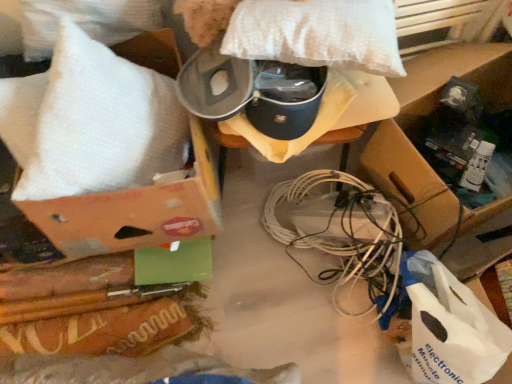
Question: Is brown cardboard box at lower right located within white bubble wrap at upper left, the 2th pillow when ordered from right to left?

Choices:
 (A) yes
 (B) no

Answer: (B)

Question: Is white bubble wrap at upper left, the 2th pillow when ordered from right to left, wider than brown cardboard box at lower right?

Choices:
 (A) yes
 (B) no

Answer: (B)

Question: Is white bubble wrap at upper left, marked as the first pillow in a left-to-right arrangement, shorter than brown cardboard box at lower right?

Choices:
 (A) yes
 (B) no

Answer: (A)

Question: Is white bubble wrap at upper left, the 2th pillow when ordered from right to left, with brown cardboard box at lower right?

Choices:
 (A) yes
 (B) no

Answer: (B)

Question: From the image's perspective, is white bubble wrap at upper left, the 2th pillow when ordered from right to left, below brown cardboard box at lower right?

Choices:
 (A) yes
 (B) no

Answer: (B)

Question: Looking at their shapes, would you say brown cardboard box at lower right is wider or thinner than white plastic wire at center?

Choices:
 (A) wide
 (B) thin

Answer: (A)

Question: From a real-world perspective, is brown cardboard box at lower right positioned above or below white plastic wire at center?

Choices:
 (A) below
 (B) above

Answer: (B)

Question: Considering the positions of point (509, 243) and point (329, 279), is point (509, 243) closer or farther from the camera than point (329, 279)?

Choices:
 (A) farther
 (B) closer

Answer: (A)

Question: From their relative heights in the image, would you say brown cardboard box at lower right is taller or shorter than white plastic wire at center?

Choices:
 (A) tall
 (B) short

Answer: (A)

Question: In the image, is white dotted pillow at upper center, which is the 2th pillow in left-to-right order, on the left side or the right side of brown cardboard box at lower right?

Choices:
 (A) left
 (B) right

Answer: (A)

Question: Considering the positions of white dotted pillow at upper center, which is the 2th pillow in left-to-right order, and brown cardboard box at lower right in the image, is white dotted pillow at upper center, which is the 2th pillow in left-to-right order, taller or shorter than brown cardboard box at lower right?

Choices:
 (A) tall
 (B) short

Answer: (B)

Question: Do you think white dotted pillow at upper center, the first pillow in the right-to-left sequence, is within brown cardboard box at lower right, or outside of it?

Choices:
 (A) outside
 (B) inside

Answer: (A)

Question: Is white dotted pillow at upper center, which is the 2th pillow in left-to-right order, wider or thinner than brown cardboard box at lower right?

Choices:
 (A) wide
 (B) thin

Answer: (B)

Question: In the image, is white plastic bag at lower right positioned in front of or behind brown cardboard box at lower right?

Choices:
 (A) behind
 (B) front

Answer: (B)

Question: From the image's perspective, relative to brown cardboard box at lower right, is white plastic bag at lower right above or below?

Choices:
 (A) above
 (B) below

Answer: (B)